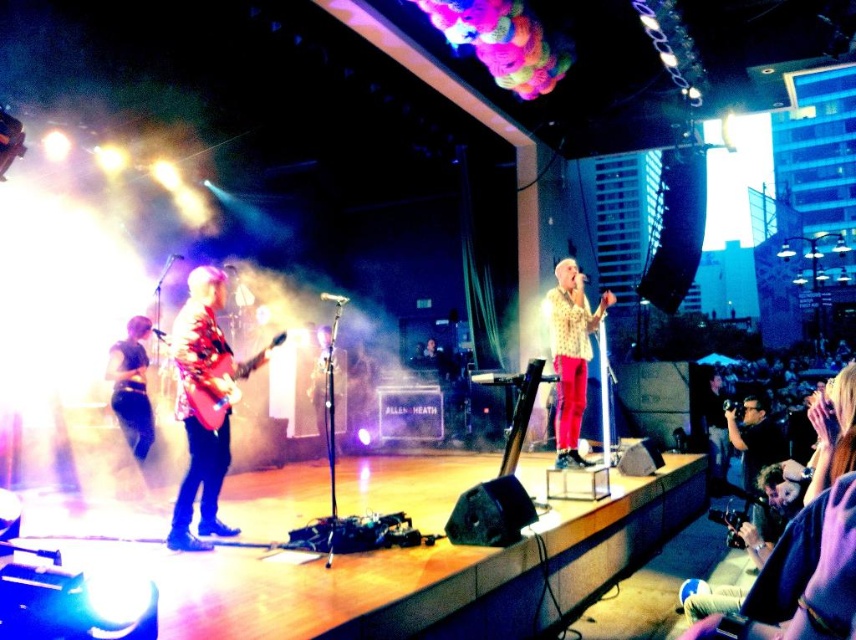
You are a photographer standing in front of the stage, and you want to capture a closeup shot of the glossy wood guitar at left. Based on its position, where should you aim your camera?

The glossy wood guitar at left is located at the 2D coordinates point (200,406). You should aim your camera towards that coordinate to capture the closeup.

You are a stagehand preparing to move equipment. You see the glossy wood guitar at left and the black fabric pants at lower left. Which object is taller?

The glossy wood guitar at left is taller than the black fabric pants at lower left.

You are a stagehand standing at the back of the stage where the vocalist is performing. You need to retrieve an item from one of two points on the stage. The first point is at coordinate point (186, 484) and the second is at point (125, 376). Which point is closer to you?

Point (125, 376) is closer to you because it is behind point (186, 484), meaning it is nearer to your position at the back of the stage.